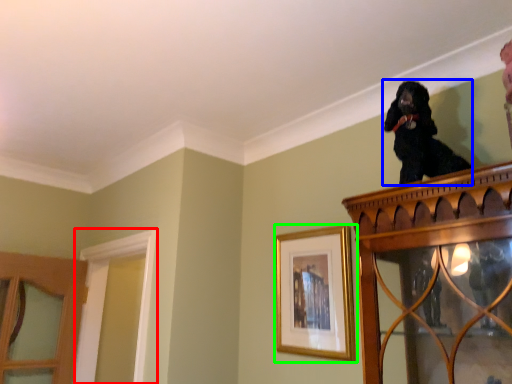
Question: Which object is positioned farthest from window frame (highlighted by a red box)? Select from dog (highlighted by a blue box) and picture frame (highlighted by a green box).

Choices:
 (A) dog
 (B) picture frame

Answer: (A)